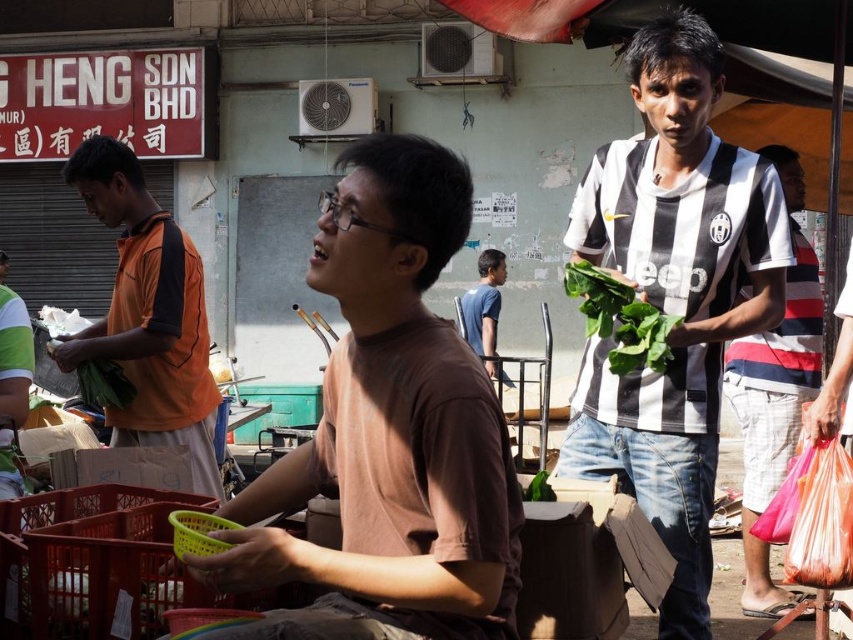
Based on the scene description, where is the striped jersey at center located in terms of coordinates?

The striped jersey at center is located at coordinates point (775,392).

You are a photographer trying to capture both the brown matte shirt at center and the blue matte shirt at center in a single frame. Based on their positions, do you think you can fit both into the camera view without moving the camera?

The brown matte shirt at center might be wider than blue matte shirt at center, so there is a possibility that the total width required to include both could exceed the camera frame. However, without exact measurements, it is uncertain. You should try adjusting the camera angle slightly to ensure both are visible.